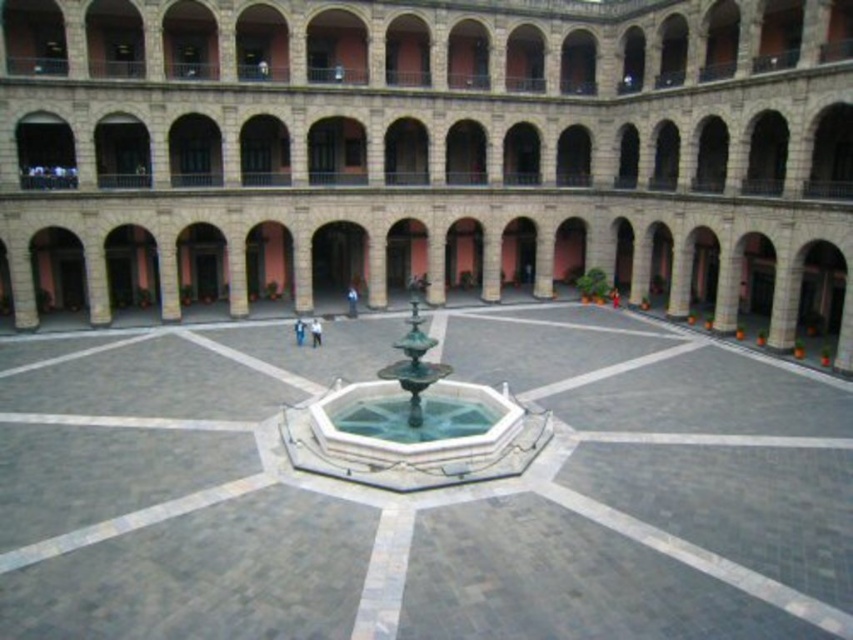
Based on the photo, you are standing in the courtyard of a grand historical building. You want to locate the polished stone fountain at center. Based on the coordinates provided, where would you look to find it?

The polished stone fountain at center is located at the coordinates point (x=422, y=492).